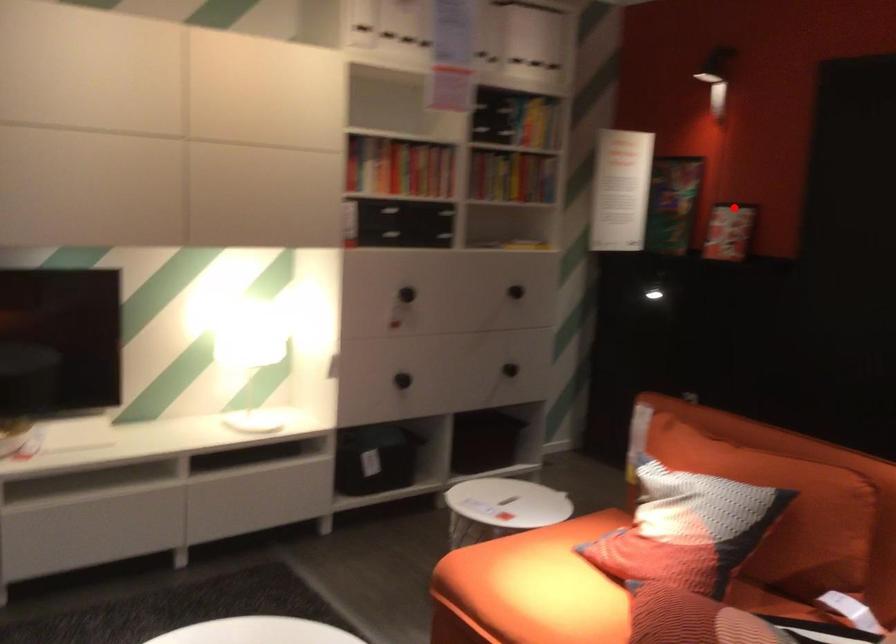
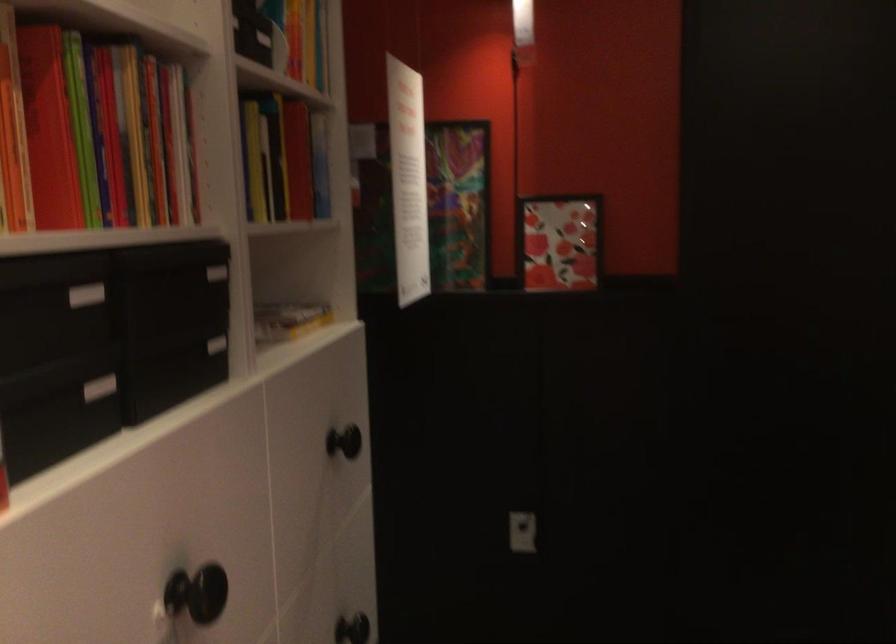
Question: A red point is marked in image1. In image2, is the corresponding 3D point closer to the camera or farther? Reply with the corresponding letter.

Choices:
 (A) The corresponding 3D point is closer.
 (B) The corresponding 3D point is farther.

Answer: (A)